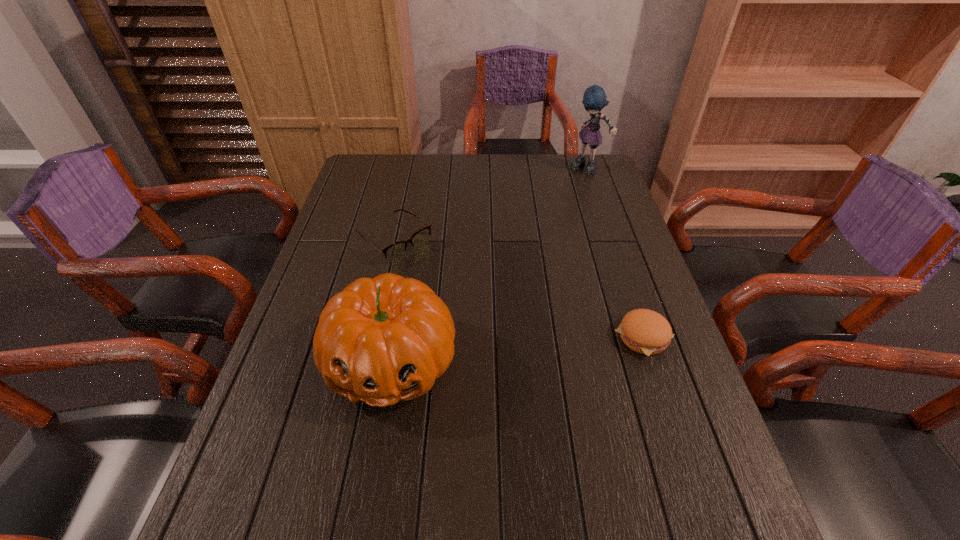
Locate an element on the screen. The width and height of the screenshot is (960, 540). free space at the left edge of the desktop is located at coordinates [x=318, y=261].

Where is `free space at the right edge of the desktop`? free space at the right edge of the desktop is located at coordinates (611, 226).

In the image, there is a desktop. At what (x,y) coordinates should I click in order to perform the action: click on free space at the near left corner. Please return your answer as a coordinate pair (x, y). Looking at the image, I should click on (249, 471).

Identify the location of free space between the farthest object and the third nearest object. This screenshot has height=540, width=960. (491, 204).

In order to click on free space between the second tallest object and the patty in this screenshot , I will do `click(516, 348)`.

At what (x,y) coordinates should I click in order to perform the action: click on vacant area that lies between the spectacles and the patty. Please return your answer as a coordinate pair (x, y). The width and height of the screenshot is (960, 540). Looking at the image, I should click on (518, 288).

The width and height of the screenshot is (960, 540). What are the coordinates of `free space that is in between the tallest object and the patty` in the screenshot? It's located at pos(615,253).

At what (x,y) coordinates should I click in order to perform the action: click on unoccupied area between the patty and the second tallest object. Please return your answer as a coordinate pair (x, y). Image resolution: width=960 pixels, height=540 pixels. Looking at the image, I should click on (516, 348).

Image resolution: width=960 pixels, height=540 pixels. In order to click on blank region between the spectacles and the rag doll in this screenshot , I will do `click(491, 204)`.

Where is `free space between the second farthest object and the farthest object`? free space between the second farthest object and the farthest object is located at coordinates click(x=491, y=204).